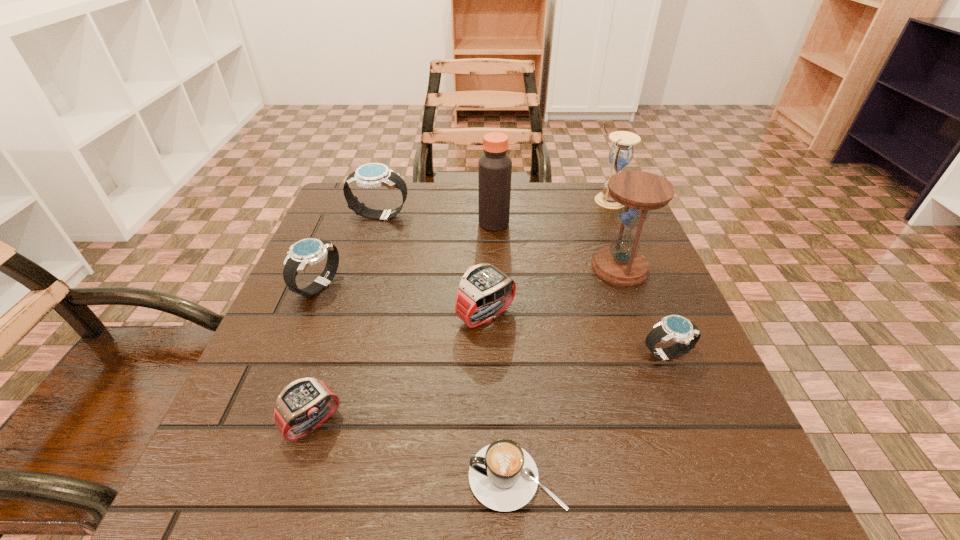
The image size is (960, 540). Identify the location of brown vinegar. (494, 167).

Locate an element on the screen. This screenshot has height=540, width=960. the farther hourglass is located at coordinates (621, 153).

Where is `the nearer hourglass`? the nearer hourglass is located at coordinates (621, 263).

I want to click on the farthest watch, so click(373, 175).

The image size is (960, 540). What are the coordinates of `the tallest watch` in the screenshot? It's located at (373, 175).

At what (x,y) coordinates should I click in order to perform the action: click on the second smallest silver watch. Please return your answer as a coordinate pair (x, y). This screenshot has height=540, width=960. Looking at the image, I should click on (306, 252).

Find the location of a particular element. This screenshot has height=540, width=960. the second watch from right to left is located at coordinates (485, 292).

This screenshot has height=540, width=960. What are the coordinates of `the bigger red watch` in the screenshot? It's located at (485, 292).

The width and height of the screenshot is (960, 540). In order to click on the second nearest watch in this screenshot , I will do `click(673, 327)`.

The image size is (960, 540). In order to click on the nearest silver watch in this screenshot , I will do `click(673, 327)`.